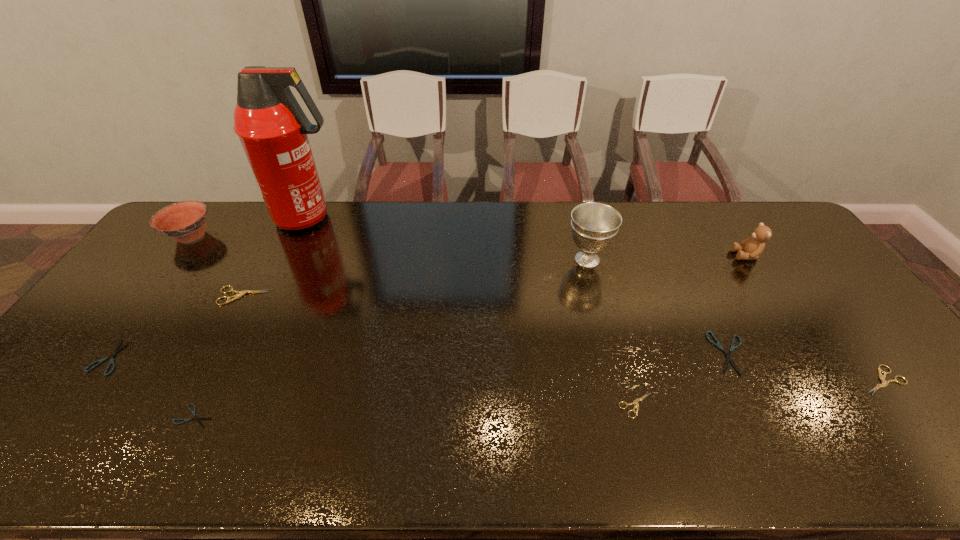
Identify the location of fire extinguisher present at the far edge. tap(272, 127).

In order to click on bowl that is at the far edge in this screenshot , I will do `click(185, 221)`.

Where is `bowl at the left edge`? The image size is (960, 540). bowl at the left edge is located at coordinates (185, 221).

Identify the location of shears at the left edge. (116, 350).

Image resolution: width=960 pixels, height=540 pixels. In order to click on object located at the right edge in this screenshot , I will do `click(884, 383)`.

Identify the location of object situated at the far left corner. The height and width of the screenshot is (540, 960). (185, 221).

Where is `vacant space at the far edge of the desktop`? vacant space at the far edge of the desktop is located at coordinates (540, 220).

Locate an element on the screen. vacant space at the near edge is located at coordinates (74, 469).

Where is `vacant space at the left edge of the desktop`? The image size is (960, 540). vacant space at the left edge of the desktop is located at coordinates (118, 317).

The width and height of the screenshot is (960, 540). What are the coordinates of `vacant position at the right edge of the desktop` in the screenshot? It's located at (847, 313).